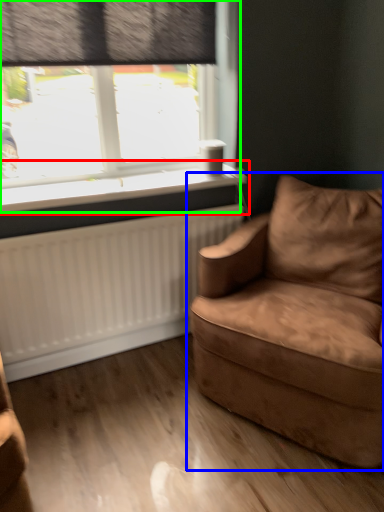
Question: Which is farther away from window sill (highlighted by a red box)? studio couch (highlighted by a blue box) or window (highlighted by a green box)?

Choices:
 (A) studio couch
 (B) window

Answer: (A)